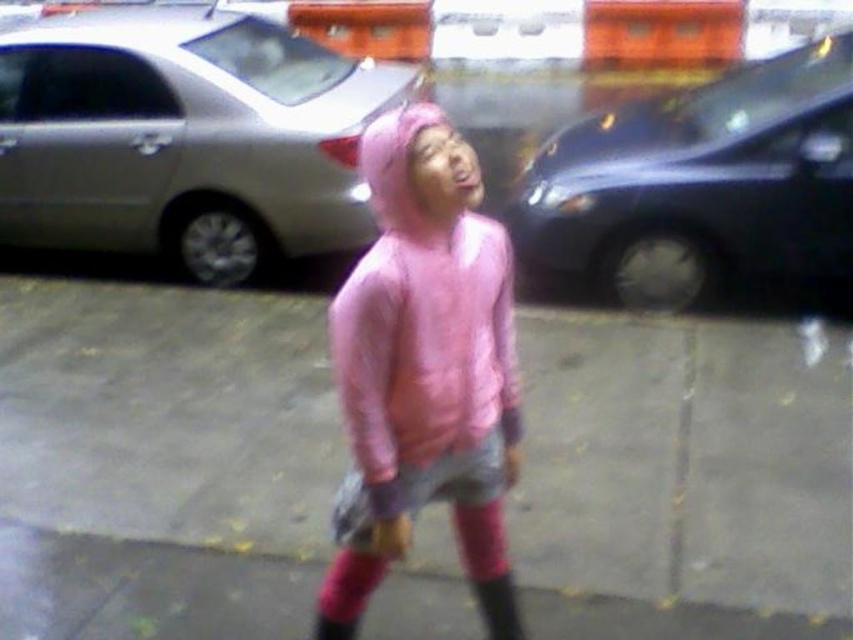
Does silver metallic sedan at center appear over pink rubber rain boot at center?

Indeed, silver metallic sedan at center is positioned over pink rubber rain boot at center.

Can you confirm if silver metallic sedan at center is bigger than pink rubber rain boot at center?

Indeed, silver metallic sedan at center has a larger size compared to pink rubber rain boot at center.

At what (x,y) coordinates should I click in order to perform the action: click on silver metallic sedan at center. Please return your answer as a coordinate pair (x, y). Looking at the image, I should click on (184, 138).

Can you confirm if silver metallic sedan at center is positioned to the left of shiny black car at right?

Indeed, silver metallic sedan at center is positioned on the left side of shiny black car at right.

From the picture: Is silver metallic sedan at center closer to the viewer compared to shiny black car at right?

No, silver metallic sedan at center is behind shiny black car at right.

Locate an element on the screen. This screenshot has height=640, width=853. silver metallic sedan at center is located at coordinates (184, 138).

Between pink matte hoodie at center and shiny black car at right, which one appears on the right side from the viewer's perspective?

shiny black car at right is more to the right.

Which of these two, pink matte hoodie at center or shiny black car at right, stands taller?

With more height is shiny black car at right.

Identify the location of pink matte hoodie at center. Image resolution: width=853 pixels, height=640 pixels. (421, 364).

Where is `pink matte hoodie at center`? The image size is (853, 640). pink matte hoodie at center is located at coordinates (421, 364).